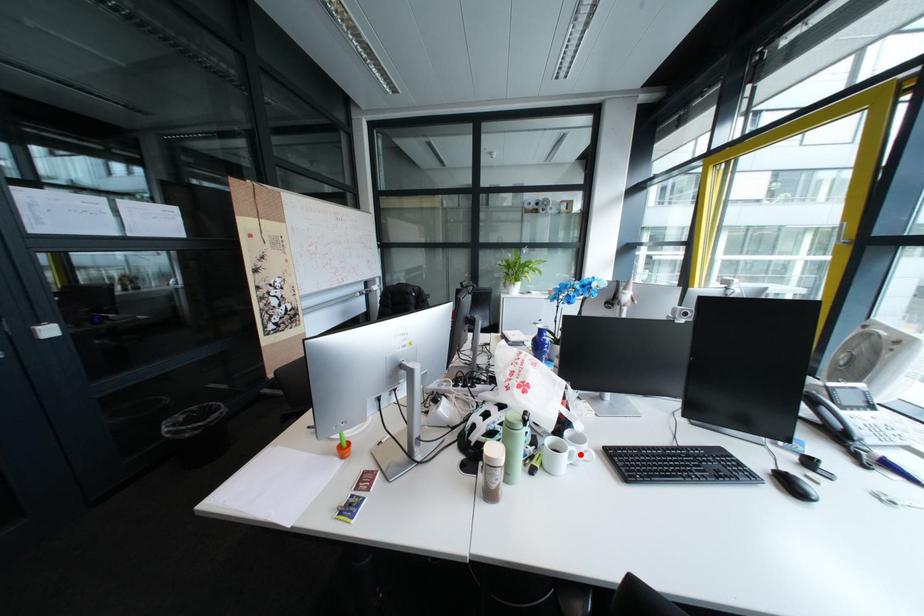
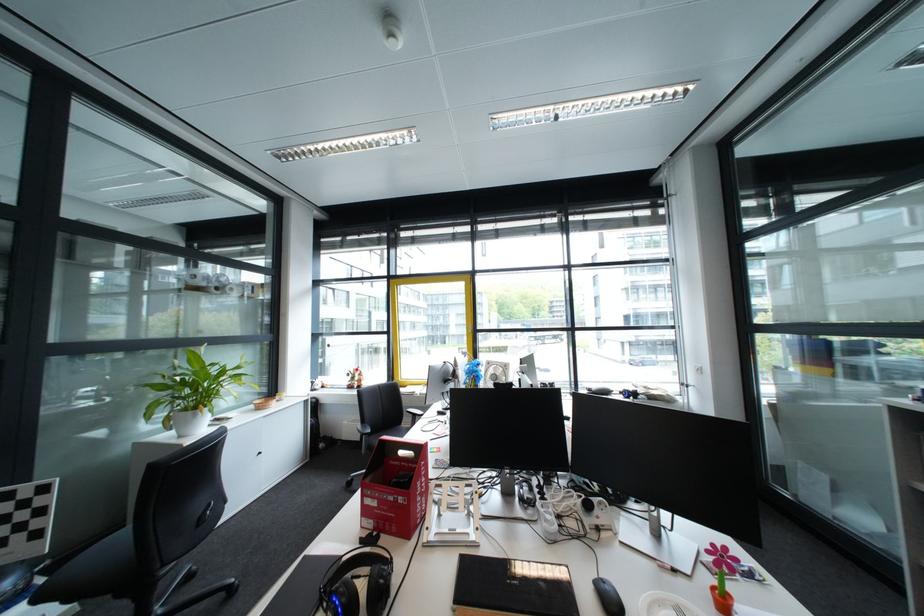
Question: I am providing you with two images of the same scene from different viewpoints. A red point is marked on the first image. Is the red point's position out of view in image 2?

Choices:
 (A) Yes
 (B) No

Answer: (A)